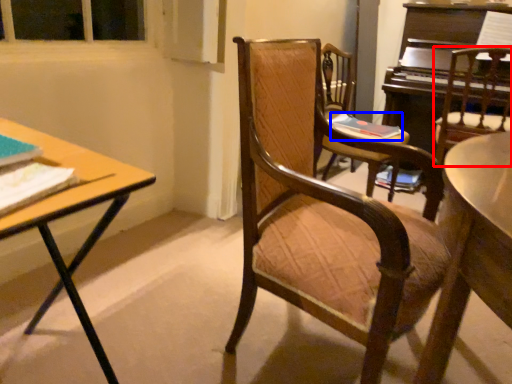
Question: Among these objects, which one is farthest to the camera, chair (highlighted by a red box) or book (highlighted by a blue box)?

Choices:
 (A) chair
 (B) book

Answer: (B)